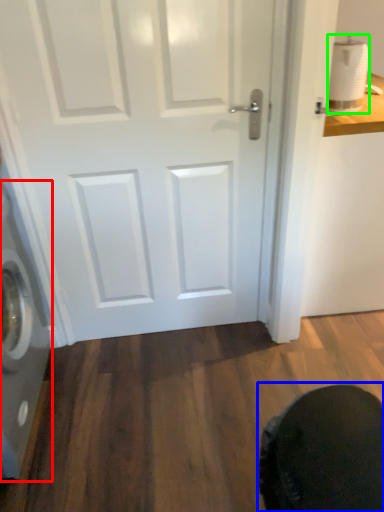
Question: Estimate the real-world distances between objects in this image. Which object is closer to washing machine (highlighted by a red box), swivel chair (highlighted by a blue box) or toilet paper (highlighted by a green box)?

Choices:
 (A) swivel chair
 (B) toilet paper

Answer: (A)